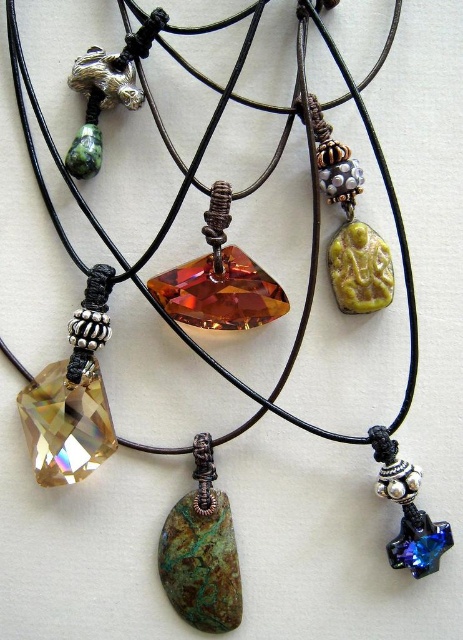
Is iridescent glass pendant at center above green carved stone at center-right?

Incorrect, iridescent glass pendant at center is not positioned above green carved stone at center-right.

Is iridescent glass pendant at center in front of green carved stone at center-right?

No, it is not.

Between point (66, 381) and point (343, 240), which one is positioned in front?

Point (66, 381) is in front.

At what (x,y) coordinates should I click in order to perform the action: click on iridescent glass pendant at center. Please return your answer as a coordinate pair (x, y). Image resolution: width=463 pixels, height=640 pixels. Looking at the image, I should click on (73, 396).

Is citrine crystal pendant at center to the left of green carved stone at center-right from the viewer's perspective?

Yes, citrine crystal pendant at center is to the left of green carved stone at center-right.

Is citrine crystal pendant at center above green carved stone at center-right?

No, citrine crystal pendant at center is not above green carved stone at center-right.

Where is `citrine crystal pendant at center`? This screenshot has height=640, width=463. citrine crystal pendant at center is located at coordinates (219, 280).

Is point (237, 612) closer to viewer compared to point (382, 296)?

That is True.

Is point (176, 525) farther from camera compared to point (357, 259)?

No, it is not.

Where is `green stone pendant at center`? The width and height of the screenshot is (463, 640). green stone pendant at center is located at coordinates (201, 552).

I want to click on green stone pendant at center, so click(201, 552).